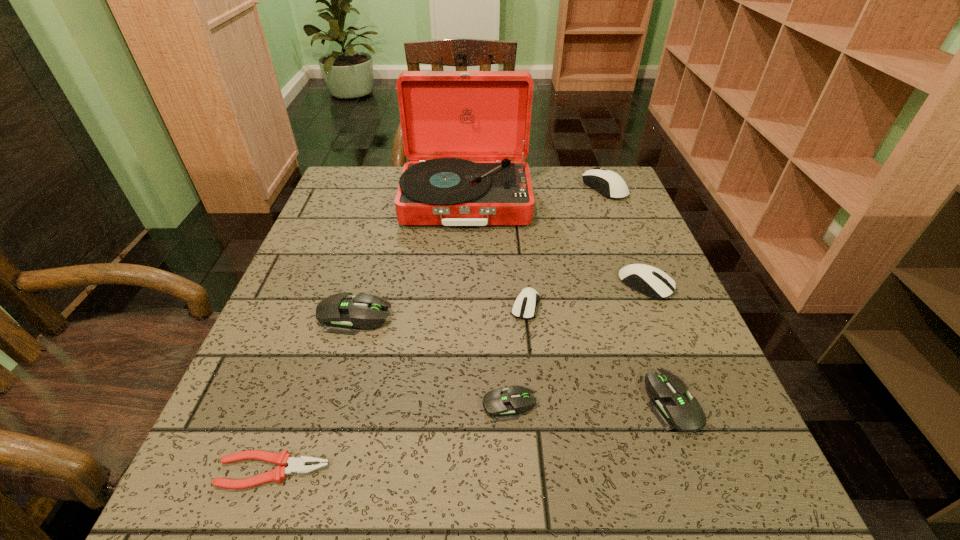
This screenshot has height=540, width=960. What are the coordinates of `gray computer mouse that stands as the closest to the second smallest gray computer mouse` in the screenshot? It's located at (502, 404).

Locate an element on the screen. This screenshot has width=960, height=540. gray computer mouse identified as the second closest to the shortest object is located at coordinates (502, 404).

What are the coordinates of `vacant region that satisfies the following two spatial constraints: 1. on the front-facing side of the tallest object; 2. on the right side of the shortest computer mouse` in the screenshot? It's located at (457, 404).

Where is `vacant space that satisfies the following two spatial constraints: 1. on the front-facing side of the phonograph_record; 2. on the left side of the rightmost gray computer mouse`? The width and height of the screenshot is (960, 540). vacant space that satisfies the following two spatial constraints: 1. on the front-facing side of the phonograph_record; 2. on the left side of the rightmost gray computer mouse is located at coordinates (457, 404).